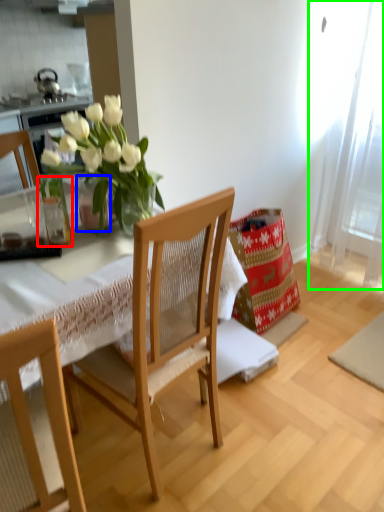
Question: Considering the real-world distances, which object is farthest from glass vase (highlighted by a red box)? vase (highlighted by a blue box) or curtain (highlighted by a green box)?

Choices:
 (A) vase
 (B) curtain

Answer: (B)